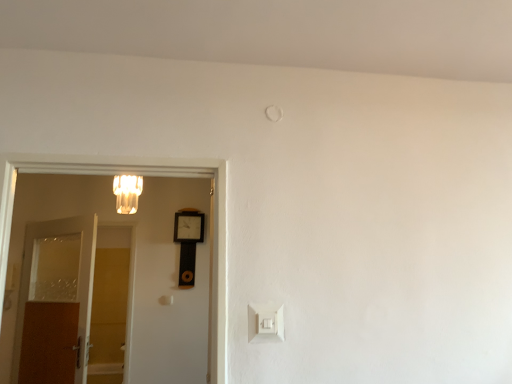
Question: Does brown wooden door at left, which appears as the first door when viewed from the left, have a greater height compared to matte glass chandelier at upper left?

Choices:
 (A) yes
 (B) no

Answer: (A)

Question: Does brown wooden door at left, which appears as the first door when viewed from the left, have a larger size compared to matte glass chandelier at upper left?

Choices:
 (A) yes
 (B) no

Answer: (A)

Question: Can you confirm if brown wooden door at left, arranged as the 2th door when viewed from the front, is wider than matte glass chandelier at upper left?

Choices:
 (A) no
 (B) yes

Answer: (A)

Question: Is brown wooden door at left, which appears as the first door when viewed from the left, thinner than matte glass chandelier at upper left?

Choices:
 (A) no
 (B) yes

Answer: (B)

Question: Are brown wooden door at left, acting as the 2th door starting from the right, and matte glass chandelier at upper left beside each other?

Choices:
 (A) no
 (B) yes

Answer: (A)

Question: Visually, is matte glass chandelier at upper left positioned to the left or to the right of white wooden door at left, positioned as the second door in left-to-right order?

Choices:
 (A) left
 (B) right

Answer: (A)

Question: Does point (120, 196) appear closer or farther from the camera than point (13, 162)?

Choices:
 (A) farther
 (B) closer

Answer: (A)

Question: From a real-world perspective, is matte glass chandelier at upper left physically located above or below white wooden door at left, positioned as the second door in left-to-right order?

Choices:
 (A) below
 (B) above

Answer: (B)

Question: In terms of size, does matte glass chandelier at upper left appear bigger or smaller than white wooden door at left, marked as the second door in a back-to-front arrangement?

Choices:
 (A) big
 (B) small

Answer: (B)

Question: In terms of height, does matte glass chandelier at upper left look taller or shorter compared to white plastic light switch at lower center?

Choices:
 (A) short
 (B) tall

Answer: (B)

Question: Based on their positions, is matte glass chandelier at upper left located to the left or right of white plastic light switch at lower center?

Choices:
 (A) right
 (B) left

Answer: (B)

Question: From a real-world perspective, is matte glass chandelier at upper left positioned above or below white plastic light switch at lower center?

Choices:
 (A) above
 (B) below

Answer: (A)

Question: Choose the correct answer: Is matte glass chandelier at upper left inside white plastic light switch at lower center or outside it?

Choices:
 (A) outside
 (B) inside

Answer: (A)

Question: From the image's perspective, relative to wooden clock at center, is white plastic light switch at lower center above or below?

Choices:
 (A) above
 (B) below

Answer: (B)

Question: In terms of size, does white plastic light switch at lower center appear bigger or smaller than wooden clock at center?

Choices:
 (A) big
 (B) small

Answer: (B)